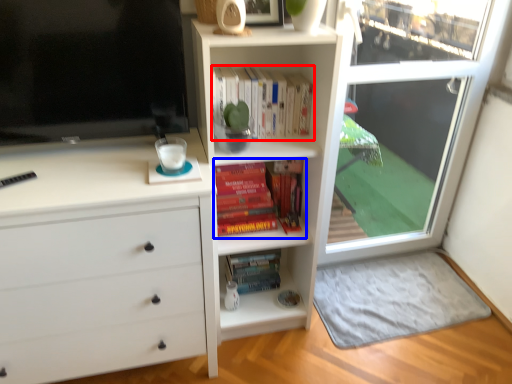
Question: Which object is closer to the camera taking this photo, book (highlighted by a red box) or book (highlighted by a blue box)?

Choices:
 (A) book
 (B) book

Answer: (A)